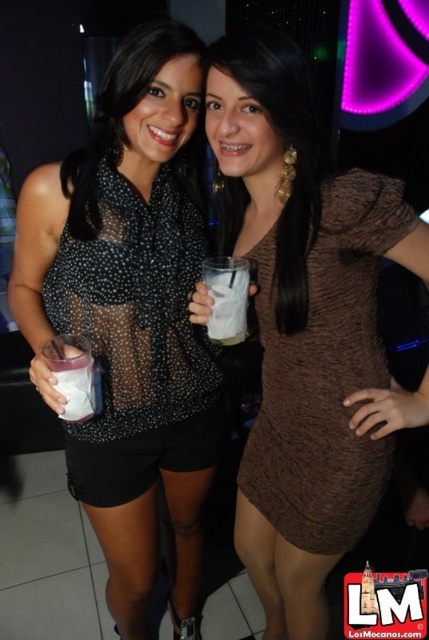
You are a photographer at a party and want to capture a closeup of both the sheer black blouse at center and the white frothy drink at center in the same frame. Can you position your camera so that both items are within the frame without moving either object? The minimum distance your camera can focus on two objects in the same frame is 10 inches.

The sheer black blouse at center and white frothy drink at center are 10.66 inches apart from each other. Since the minimum focus distance for two objects is 10 inches, the camera can capture both in the same frame as 10.66 inches is greater than 10 inches.

You are a photographer standing at the camera position. You want to take a closeup shot of the black sheer top at center. Considering the distance between you and the top, is it possible to capture the entire top in your photo without moving closer?

The distance between the black sheer top at center and the camera is 39.02 inches. Since this distance is fixed and you cannot move closer, capturing the entire top in the photo without moving closer may not be feasible unless the camera has a wide enough lens to accommodate the framing at that distance.

You are a photographer at a party and want to take a closeup shot of both the black sheer top at center and the sheer black blouse at center. Can you fit both into the frame if your camera has a minimum focus distance of 2 inches?

The black sheer top at center and the sheer black blouse at center are 2.32 inches apart from each other. Since the minimum focus distance is 2 inches, the camera can focus on both as the distance between them is greater than the required minimum.